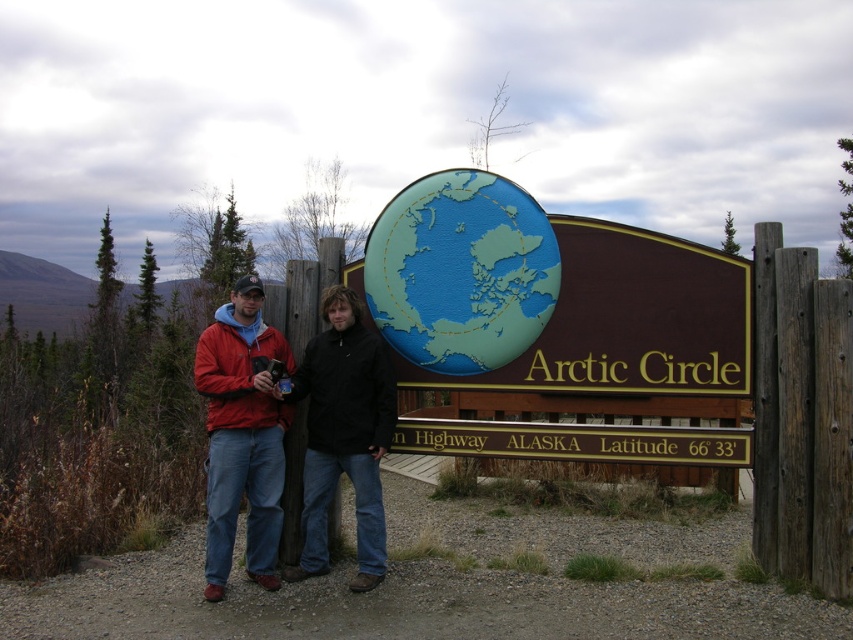
Question: Can you confirm if matte blue globe at center is bigger than matte black jacket at center?

Choices:
 (A) no
 (B) yes

Answer: (A)

Question: Considering the relative positions of brown wooden sign at center and matte blue globe at center in the image provided, where is brown wooden sign at center located with respect to matte blue globe at center?

Choices:
 (A) right
 (B) left

Answer: (A)

Question: Among these points, which one is farthest from the camera?

Choices:
 (A) (271, 556)
 (B) (433, 209)
 (C) (480, 216)

Answer: (B)

Question: Is brown wooden sign at center positioned at the back of matte blue globe at center?

Choices:
 (A) no
 (B) yes

Answer: (A)

Question: Which point is farther to the camera?

Choices:
 (A) brown wooden sign at center
 (B) matte blue globe at center

Answer: (B)

Question: Which point is farther to the camera?

Choices:
 (A) brown wooden sign at center
 (B) matte black jacket at center
 (C) matte blue globe at center

Answer: (C)